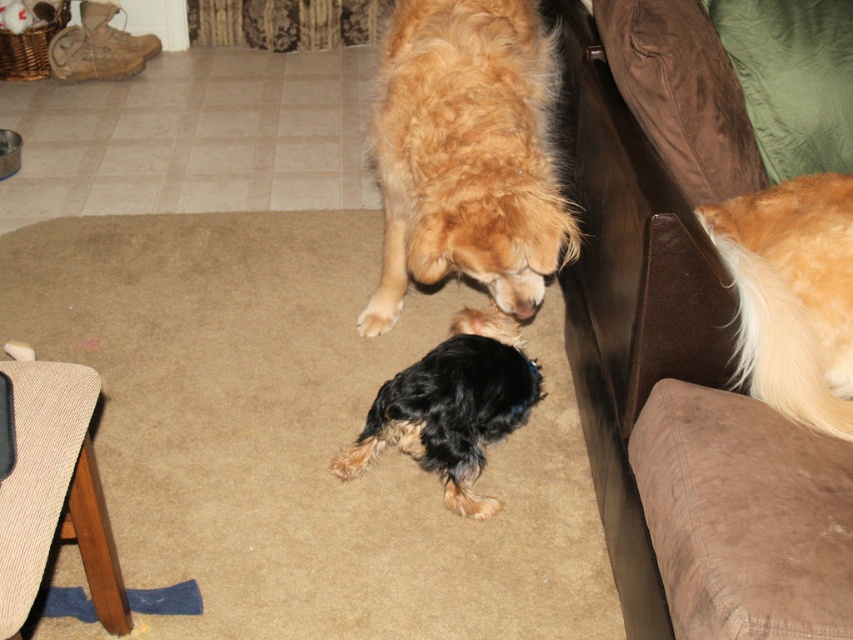
Question: Does brown suede couch at upper right have a lesser width compared to golden fur dog at right?

Choices:
 (A) yes
 (B) no

Answer: (B)

Question: Is the position of brown suede couch at upper right less distant than that of black silky dog at center?

Choices:
 (A) yes
 (B) no

Answer: (A)

Question: Among these points, which one is farthest from the camera?

Choices:
 (A) coord(764,362)
 (B) coord(381,330)
 (C) coord(502,406)
 (D) coord(701,332)

Answer: (B)

Question: Which of the following is the closest to the observer?

Choices:
 (A) (389, 280)
 (B) (383, 316)
 (C) (846, 348)
 (D) (665, 182)

Answer: (C)

Question: Is black silky dog at center further to camera compared to light brown fur at center?

Choices:
 (A) no
 (B) yes

Answer: (A)

Question: Estimate the real-world distances between objects in this image. Which object is closer to the brown suede couch at upper right?

Choices:
 (A) light brown fur at center
 (B) golden fur dog at right
 (C) black silky dog at center

Answer: (B)